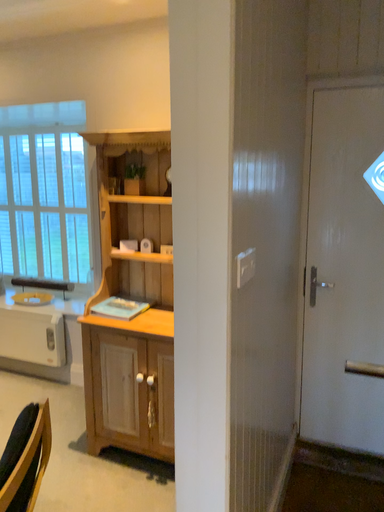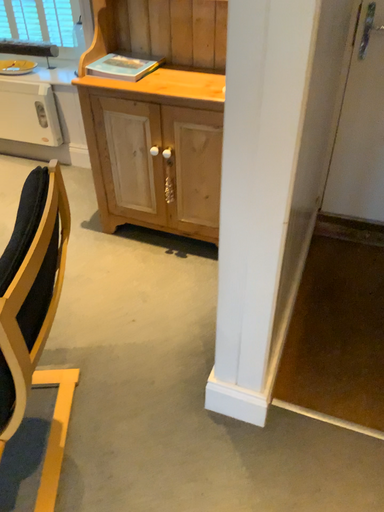
Question: How did the camera likely rotate when shooting the video?

Choices:
 (A) rotated upward
 (B) rotated downward

Answer: (B)